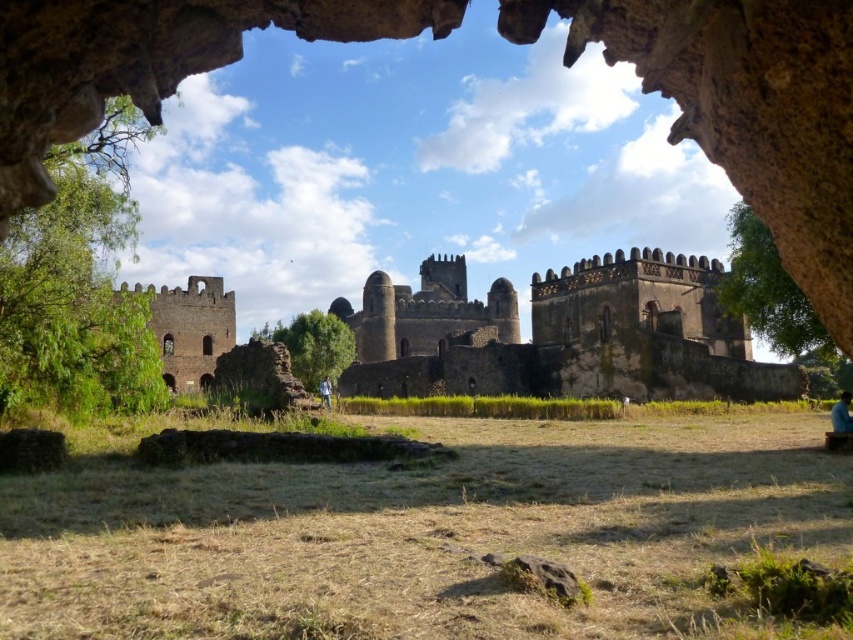
You are standing in front of the brown stone fort at left and want to take a photo of the blue fabric person at lower right through the archway. Since the fort is larger than the person, will the fort block the view of the person when you take the photo?

The brown stone fort at left is larger in size than the blue fabric person at lower right. However, since the person is positioned at lower right and the fort is at left, the fort might not necessarily block the view unless they are directly in line. The answer depends on their relative positions and the camera angle, but based on the given information, the fort being larger doesn not automatically mean it blocks the view.

You are standing at the entrance of the stone archway and see two figures in the scene. One is a blue fabric person at lower right and the other is blue denim jeans at lower center. Which figure appears bigger in size?

The blue fabric person at lower right appears bigger in size compared to the blue denim jeans at lower center.